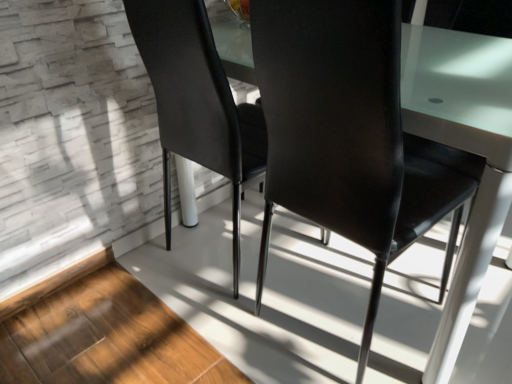
Identify the location of free spot in front of matte black chair at center, arranged as the second chair when viewed from the right. The image size is (512, 384). (183, 333).